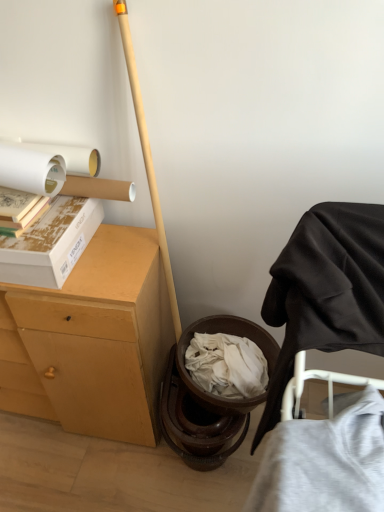
Question: Is the position of gray cotton t-shirt at lower right more distant than that of black fabric chair at right?

Choices:
 (A) no
 (B) yes

Answer: (A)

Question: Is gray cotton t-shirt at lower right closer to camera compared to black fabric chair at right?

Choices:
 (A) no
 (B) yes

Answer: (B)

Question: Is gray cotton t-shirt at lower right not near black fabric chair at right?

Choices:
 (A) yes
 (B) no

Answer: (B)

Question: Is gray cotton t-shirt at lower right bigger than black fabric chair at right?

Choices:
 (A) no
 (B) yes

Answer: (A)

Question: Is gray cotton t-shirt at lower right looking in the opposite direction of black fabric chair at right?

Choices:
 (A) no
 (B) yes

Answer: (A)

Question: Does point (150, 416) appear closer or farther from the camera than point (36, 150)?

Choices:
 (A) farther
 (B) closer

Answer: (A)

Question: Is light brown wood desk at left wider or thinner than white matte toilet paper at upper left?

Choices:
 (A) thin
 (B) wide

Answer: (B)

Question: Is light brown wood desk at left taller or shorter than white matte toilet paper at upper left?

Choices:
 (A) tall
 (B) short

Answer: (A)

Question: From a real-world perspective, is light brown wood desk at left physically located above or below white matte toilet paper at upper left?

Choices:
 (A) above
 (B) below

Answer: (B)

Question: Considering the positions of gray cotton t-shirt at lower right and light brown wood desk at left in the image, is gray cotton t-shirt at lower right taller or shorter than light brown wood desk at left?

Choices:
 (A) short
 (B) tall

Answer: (A)

Question: Would you say gray cotton t-shirt at lower right is to the left or to the right of light brown wood desk at left in the picture?

Choices:
 (A) right
 (B) left

Answer: (A)

Question: Looking at their shapes, would you say gray cotton t-shirt at lower right is wider or thinner than light brown wood desk at left?

Choices:
 (A) thin
 (B) wide

Answer: (A)

Question: Is gray cotton t-shirt at lower right bigger or smaller than light brown wood desk at left?

Choices:
 (A) big
 (B) small

Answer: (B)

Question: Considering their positions, is gray cotton t-shirt at lower right located in front of or behind matte cardboard book at upper left?

Choices:
 (A) front
 (B) behind

Answer: (A)

Question: From the image's perspective, is gray cotton t-shirt at lower right located above or below matte cardboard book at upper left?

Choices:
 (A) below
 (B) above

Answer: (A)